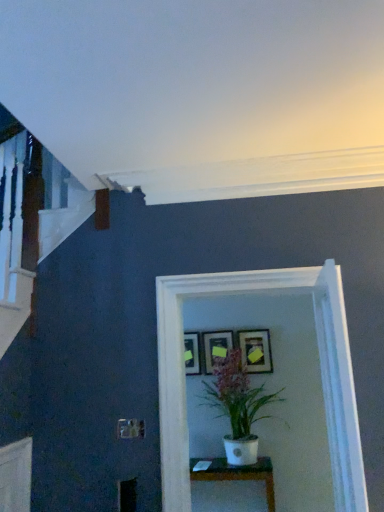
What is the approximate width of white matte pot at center?

The width of white matte pot at center is 19.46 inches.

What is the approximate width of matte gold picture frame at center, which is the 3th picture frame from left to right?

matte gold picture frame at center, which is the 3th picture frame from left to right, is 2.71 inches wide.

In order to face matte gold picture frame at center, which is counted as the first picture frame, starting from the right, should I rotate leftwards or rightwards?

It's best to rotate right around 8.369 degrees.

I want to click on white glossy glass door at center, so click(x=320, y=360).

What do you see at coordinates (216, 348) in the screenshot? I see `matte black picture frame at center, the second picture frame when ordered from left to right` at bounding box center [216, 348].

I want to click on matte black picture frame at center, which is counted as the second picture frame, starting from the right, so click(216, 348).

This screenshot has width=384, height=512. I want to click on white matte pot at center, so [237, 406].

Which picture frame is the 1st one when counting from the front of the matte black picture frame at center, placed as the 3th picture frame when sorted from right to left? Please provide its 2D coordinates.

[(216, 348)]

From a real-world perspective, is matte black picture frame at center, placed as the 3th picture frame when sorted from right to left, located beneath matte black picture frame at center, which is counted as the second picture frame, starting from the right?

Yes, from a real-world perspective, matte black picture frame at center, placed as the 3th picture frame when sorted from right to left, is beneath matte black picture frame at center, which is counted as the second picture frame, starting from the right.

Would you consider matte black picture frame at center, the 1th picture frame viewed from the left, to be distant from matte black picture frame at center, which is counted as the second picture frame, starting from the right?

That's not correct — matte black picture frame at center, the 1th picture frame viewed from the left, is a little close to matte black picture frame at center, which is counted as the second picture frame, starting from the right.

Is matte black picture frame at center, placed as the 3th picture frame when sorted from right to left, not within matte black picture frame at center, which is counted as the second picture frame, starting from the right?

Yes.

Is white glossy table at center oriented away from white glossy glass door at center?

No, white glossy table at center is not facing away from white glossy glass door at center.

From a real-world perspective, who is located higher, white glossy table at center or white glossy glass door at center?

In real-world perspective, white glossy glass door at center is above.

Is there a large distance between white glossy table at center and white glossy glass door at center?

Yes, white glossy table at center is far from white glossy glass door at center.

Consider the image. Considering the sizes of objects white glossy table at center and white glossy glass door at center in the image provided, who is bigger, white glossy table at center or white glossy glass door at center?

white glossy glass door at center is bigger.

Is there a large distance between matte gold picture frame at center, which is counted as the first picture frame, starting from the right, and white matte pot at center?

matte gold picture frame at center, which is counted as the first picture frame, starting from the right, is near white matte pot at center, not far away.

Which picture frame is the 1st one when counting from the back of the white matte pot at center? Please provide its 2D coordinates.

[(256, 351)]

From a real-world perspective, is matte gold picture frame at center, which is counted as the first picture frame, starting from the right, positioned under white matte pot at center based on gravity?

No, from a real-world perspective, matte gold picture frame at center, which is counted as the first picture frame, starting from the right, is not under white matte pot at center.

From the image's perspective, relative to white matte pot at center, is matte gold picture frame at center, which is the 3th picture frame from left to right, above or below?

matte gold picture frame at center, which is the 3th picture frame from left to right, is above white matte pot at center.

In the scene shown: From a real-world perspective, who is located lower, white matte pot at center or matte black picture frame at center, placed as the 3th picture frame when sorted from right to left?

white matte pot at center.

Which of these two, white matte pot at center or matte black picture frame at center, placed as the 3th picture frame when sorted from right to left, is smaller?

Smaller between the two is matte black picture frame at center, placed as the 3th picture frame when sorted from right to left.

Is white matte pot at center far from matte black picture frame at center, the 1th picture frame viewed from the left?

white matte pot at center is actually quite close to matte black picture frame at center, the 1th picture frame viewed from the left.

Who is taller, matte black picture frame at center, placed as the 3th picture frame when sorted from right to left, or matte gold picture frame at center, which is the 3th picture frame from left to right?

matte gold picture frame at center, which is the 3th picture frame from left to right, is taller.

Is matte black picture frame at center, the 1th picture frame viewed from the left, turned away from matte gold picture frame at center, which is the 3th picture frame from left to right?

No, matte black picture frame at center, the 1th picture frame viewed from the left,'s orientation is not away from matte gold picture frame at center, which is the 3th picture frame from left to right.

The height and width of the screenshot is (512, 384). I want to click on the 2nd picture frame to the right when counting from the matte black picture frame at center, placed as the 3th picture frame when sorted from right to left, so (x=256, y=351).

How different are the orientations of matte black picture frame at center, the 1th picture frame viewed from the left, and matte gold picture frame at center, which is counted as the first picture frame, starting from the right, in degrees?

There is a 0.00106-degree angle between the facing directions of matte black picture frame at center, the 1th picture frame viewed from the left, and matte gold picture frame at center, which is counted as the first picture frame, starting from the right.

What's the angular difference between matte black picture frame at center, which is counted as the second picture frame, starting from the right, and white matte pot at center's facing directions?

The angle between the facing direction of matte black picture frame at center, which is counted as the second picture frame, starting from the right, and the facing direction of white matte pot at center is 1.01 degrees.

Between matte black picture frame at center, which is counted as the second picture frame, starting from the right, and white matte pot at center, which one has larger size?

white matte pot at center is bigger.

From a real-world perspective, is matte black picture frame at center, which is counted as the second picture frame, starting from the right, located beneath white matte pot at center?

No, from a real-world perspective, matte black picture frame at center, which is counted as the second picture frame, starting from the right, is not below white matte pot at center.

In the scene shown: Between matte black picture frame at center, the second picture frame when ordered from left to right, and white matte pot at center, which one appears on the left side from the viewer's perspective?

Positioned to the left is matte black picture frame at center, the second picture frame when ordered from left to right.

Based on their positions, is matte gold picture frame at center, which is the 3th picture frame from left to right, located to the left or right of white glossy glass door at center?

matte gold picture frame at center, which is the 3th picture frame from left to right, is to the right of white glossy glass door at center.

In the scene shown: Between matte gold picture frame at center, which is counted as the first picture frame, starting from the right, and white glossy glass door at center, which one has smaller size?

Smaller between the two is matte gold picture frame at center, which is counted as the first picture frame, starting from the right.

In the scene shown: From the image's perspective, between matte gold picture frame at center, which is counted as the first picture frame, starting from the right, and white glossy glass door at center, who is located below?

matte gold picture frame at center, which is counted as the first picture frame, starting from the right, is shown below in the image.

Is matte gold picture frame at center, which is counted as the first picture frame, starting from the right, beside white glossy glass door at center?

They are not placed beside each other.

Where is `picture frame that is behind the matte black picture frame at center, which is counted as the second picture frame, starting from the right`? picture frame that is behind the matte black picture frame at center, which is counted as the second picture frame, starting from the right is located at coordinates (192, 353).

Where is `table that appears on the left of white glossy glass door at center`? The height and width of the screenshot is (512, 384). table that appears on the left of white glossy glass door at center is located at coordinates (239, 474).

Looking at the image, which one is located closer to matte gold picture frame at center, which is counted as the first picture frame, starting from the right, matte black picture frame at center, the second picture frame when ordered from left to right, or white glossy table at center?

Among the two, matte black picture frame at center, the second picture frame when ordered from left to right, is located nearer to matte gold picture frame at center, which is counted as the first picture frame, starting from the right.

Which object lies nearer to the anchor point white glossy table at center, white glossy glass door at center or matte black picture frame at center, the second picture frame when ordered from left to right?

matte black picture frame at center, the second picture frame when ordered from left to right, is closer to white glossy table at center.

Estimate the real-world distances between objects in this image. Which object is closer to white matte pot at center, matte black picture frame at center, which is counted as the second picture frame, starting from the right, or white glossy table at center?

The object closer to white matte pot at center is matte black picture frame at center, which is counted as the second picture frame, starting from the right.

From the image, which object appears to be farther from matte black picture frame at center, the 1th picture frame viewed from the left, matte gold picture frame at center, which is counted as the first picture frame, starting from the right, or white matte pot at center?

matte gold picture frame at center, which is counted as the first picture frame, starting from the right, is further to matte black picture frame at center, the 1th picture frame viewed from the left.

From the image, which object appears to be nearer to matte black picture frame at center, placed as the 3th picture frame when sorted from right to left, white glossy table at center or white glossy glass door at center?

white glossy table at center is closer to matte black picture frame at center, placed as the 3th picture frame when sorted from right to left.

Considering their positions, is matte black picture frame at center, the second picture frame when ordered from left to right, positioned closer to matte black picture frame at center, the 1th picture frame viewed from the left, than white glossy table at center?

Based on the image, matte black picture frame at center, the second picture frame when ordered from left to right, appears to be nearer to matte black picture frame at center, the 1th picture frame viewed from the left.

Which object lies further to the anchor point matte black picture frame at center, placed as the 3th picture frame when sorted from right to left, white glossy glass door at center or white glossy table at center?

white glossy glass door at center is positioned further to the anchor matte black picture frame at center, placed as the 3th picture frame when sorted from right to left.

Which object lies further to the anchor point white matte pot at center, matte gold picture frame at center, which is the 3th picture frame from left to right, or white glossy table at center?

The object further to white matte pot at center is white glossy table at center.

Identify the location of houseplant positioned between white glossy glass door at center and matte black picture frame at center, the 1th picture frame viewed from the left, from near to far. The width and height of the screenshot is (384, 512). (237, 406).

Find the location of a particular element. The width and height of the screenshot is (384, 512). picture frame between matte black picture frame at center, the second picture frame when ordered from left to right, and white glossy table at center from top to bottom is located at coordinates (192, 353).

The width and height of the screenshot is (384, 512). I want to click on houseplant positioned between white glossy glass door at center and matte gold picture frame at center, which is the 3th picture frame from left to right, from near to far, so click(x=237, y=406).

I want to click on houseplant between matte black picture frame at center, the 1th picture frame viewed from the left, and white glossy table at center vertically, so click(x=237, y=406).